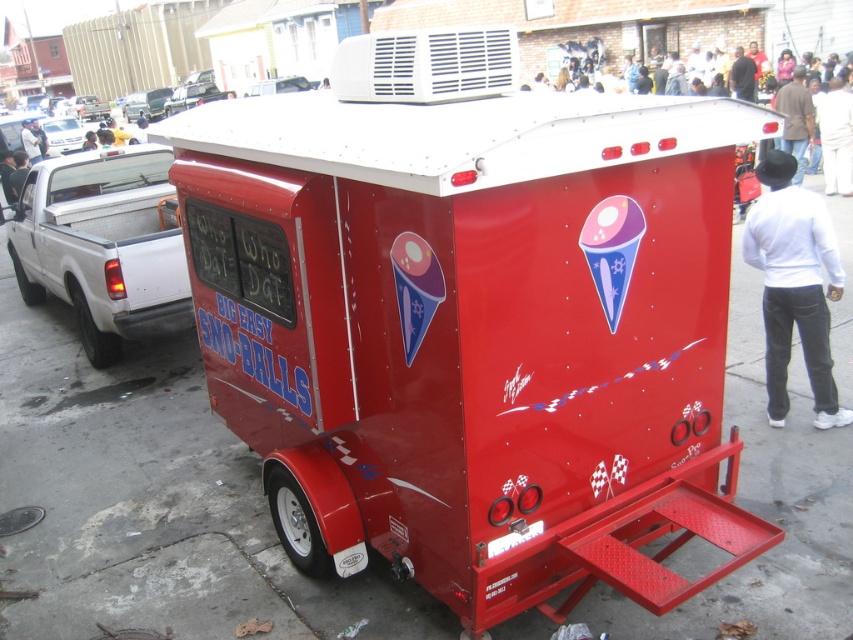
You are a delivery person needing to load a package onto the trailer. The package is the size of the shiny silver car at upper left. Is there enough space on the trailer next to the brown leather jacket at upper right to place it?

The brown leather jacket at upper right occupies less space than the shiny silver car at upper left, so there may not be enough space to place the package next to it.

You are a delivery person who needs to place a brown leather jacket at upper right onto a shelf that is 1.5 meters high. Can you reach the shelf from where the jacket is currently located?

The brown leather jacket at upper right is 11.38 meters away from the shelf. Since the distance is too far, you cannot reach the shelf from that location.